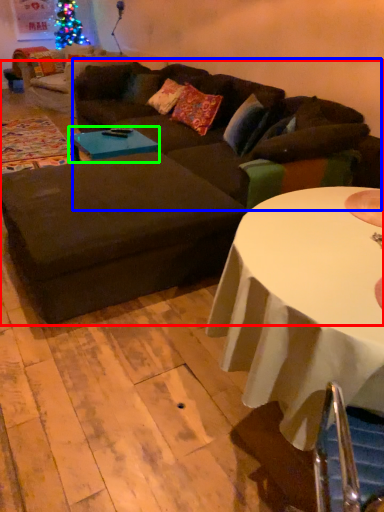
Question: Which object is positioned closest to studio couch (highlighted by a red box)? Select from couch (highlighted by a blue box) and coffee table (highlighted by a green box).

Choices:
 (A) couch
 (B) coffee table

Answer: (A)